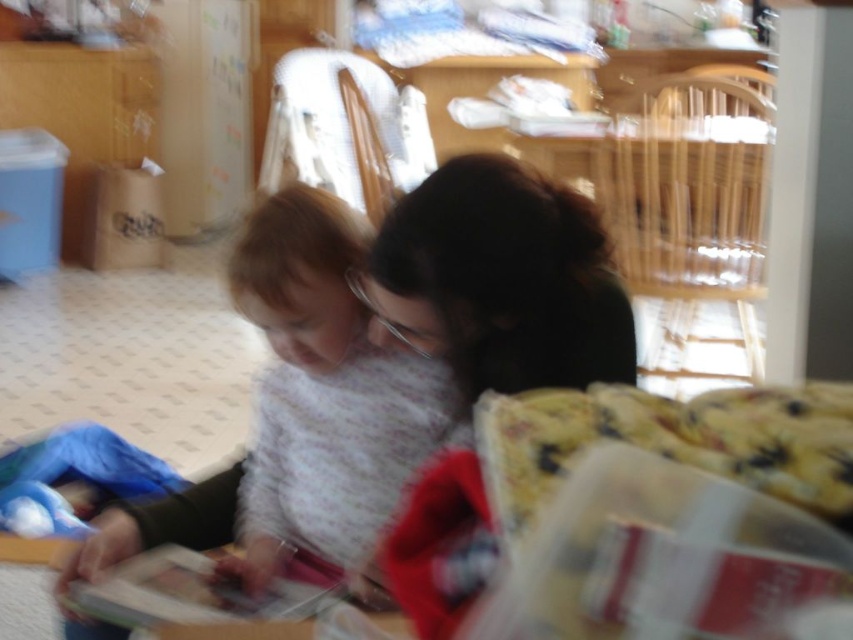
Does fluffy white sweater at center lie in front of dark green sweater at center?

No, it is not.

Who is more distant from viewer, (258, 445) or (595, 378)?

Point (258, 445)

Does point (277, 508) come behind point (532, 262)?

Yes, point (277, 508) is farther from viewer.

This screenshot has width=853, height=640. Identify the location of fluffy white sweater at center. (326, 394).